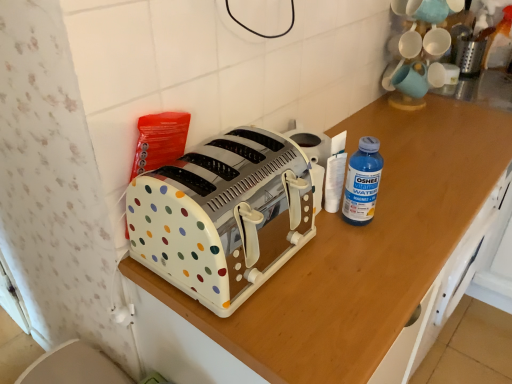
You are a GUI agent. You are given a task and a screenshot of the screen. Output one action in this format:
    pyautogui.click(x=<x>, y=<y>)
    Task: Click on the vacant area located to the right-hand side of white polka dot plastic toaster at center
    Image resolution: width=512 pixels, height=384 pixels.
    Given the screenshot: What is the action you would take?
    pyautogui.click(x=350, y=268)